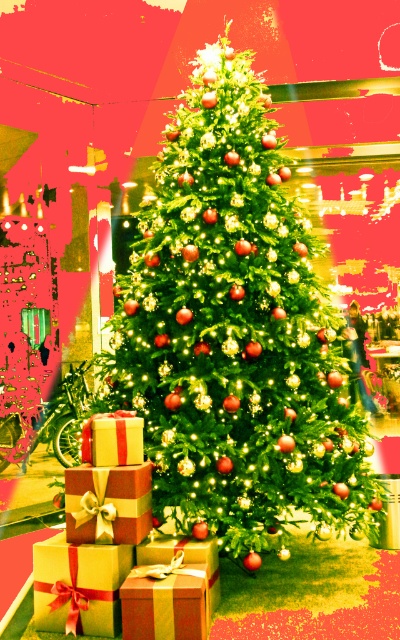
Question: Among these objects, which one is farthest from the camera?

Choices:
 (A) gold striped gift at center
 (B) gold shiny gift at center

Answer: (B)

Question: Is gold striped gift at center to the left of gold shiny gift at center from the viewer's perspective?

Choices:
 (A) no
 (B) yes

Answer: (A)

Question: Estimate the real-world distances between objects in this image. Which object is farther from the matte gold gift at center?

Choices:
 (A) gold shiny gift at center
 (B) green matte christmas tree at center

Answer: (B)

Question: Does green matte christmas tree at center have a lesser width compared to gold shiny gift at center?

Choices:
 (A) no
 (B) yes

Answer: (A)

Question: Which of the following is the farthest from the observer?

Choices:
 (A) green matte christmas tree at center
 (B) matte gold gift at center
 (C) gold shiny gift at center
 (D) gold striped gift at center

Answer: (A)

Question: Is the position of green matte christmas tree at center less distant than that of gold shiny gift at center?

Choices:
 (A) no
 (B) yes

Answer: (A)